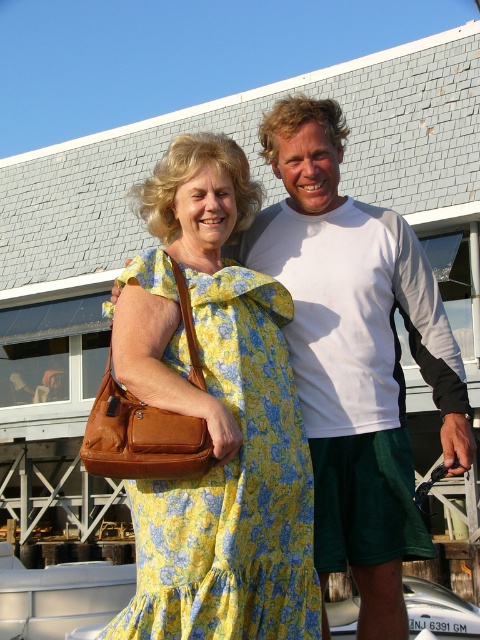
Question: Is white matte t-shirt at upper center to the right of yellow floral fabric dress at center from the viewer's perspective?

Choices:
 (A) no
 (B) yes

Answer: (B)

Question: Is white matte t-shirt at upper center below yellow floral fabric dress at center?

Choices:
 (A) yes
 (B) no

Answer: (B)

Question: Does white matte t-shirt at upper center have a smaller size compared to yellow floral fabric dress at center?

Choices:
 (A) yes
 (B) no

Answer: (B)

Question: Which point is farther to the camera?

Choices:
 (A) yellow floral fabric dress at center
 (B) white matte t-shirt at upper center

Answer: (B)

Question: Which of the following is the farthest from the observer?

Choices:
 (A) (220, 340)
 (B) (423, 282)

Answer: (B)